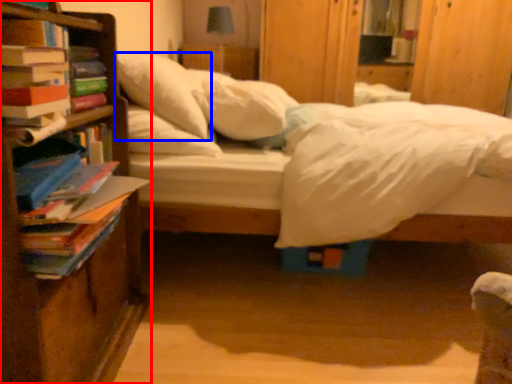
Question: Which object appears farthest to the camera in this image, bookcase (highlighted by a red box) or pillow (highlighted by a blue box)?

Choices:
 (A) bookcase
 (B) pillow

Answer: (B)